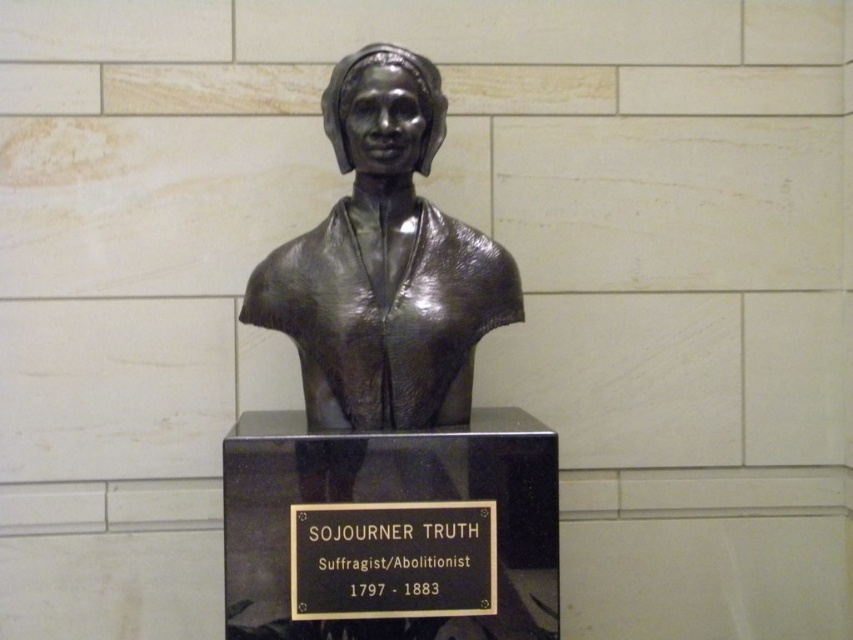
Question: Does bronze/statue at center have a larger size compared to black metal plaque at center?

Choices:
 (A) no
 (B) yes

Answer: (B)

Question: Which point is farther from the camera taking this photo?

Choices:
 (A) (318, 381)
 (B) (428, 593)

Answer: (A)

Question: Does bronze/statue at center appear on the left side of black metal plaque at center?

Choices:
 (A) yes
 (B) no

Answer: (A)

Question: Among these objects, which one is farthest from the camera?

Choices:
 (A) black metal plaque at center
 (B) bronze/statue at center

Answer: (B)

Question: Does bronze/statue at center appear on the left side of black metal plaque at center?

Choices:
 (A) no
 (B) yes

Answer: (B)